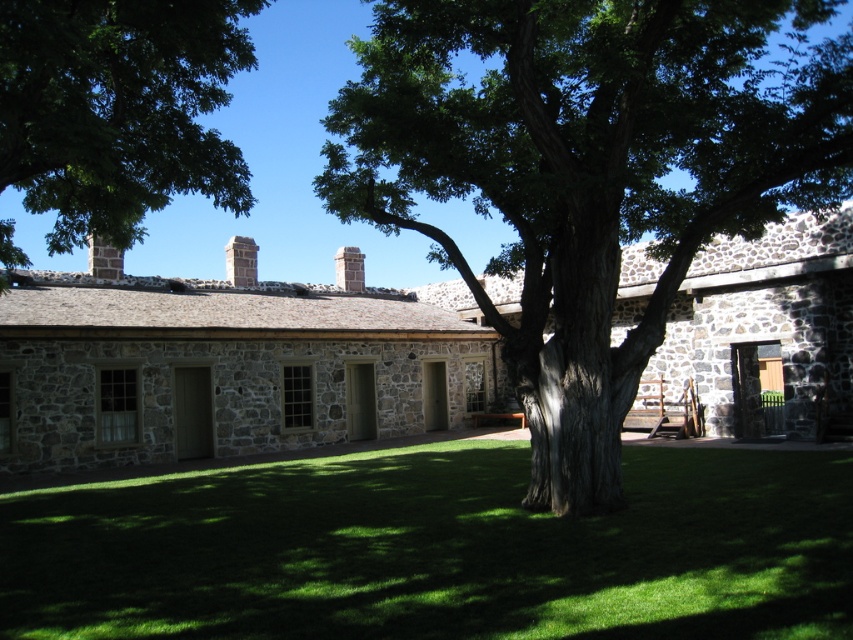
You are standing at the point marked by the coordinates point (241, 260) in the image. What object are you standing on?

You are standing on the brown stone chimney at center marked by the coordinates point (241, 260).

Based on the photo, you are a bird looking for a place to perch. You see the brown stone chimney at center and the smooth stone chimney at upper center. Which one is larger and would provide a more stable landing spot?

The brown stone chimney at center is bigger than the smooth stone chimney at upper center, so it would provide a more stable landing spot.